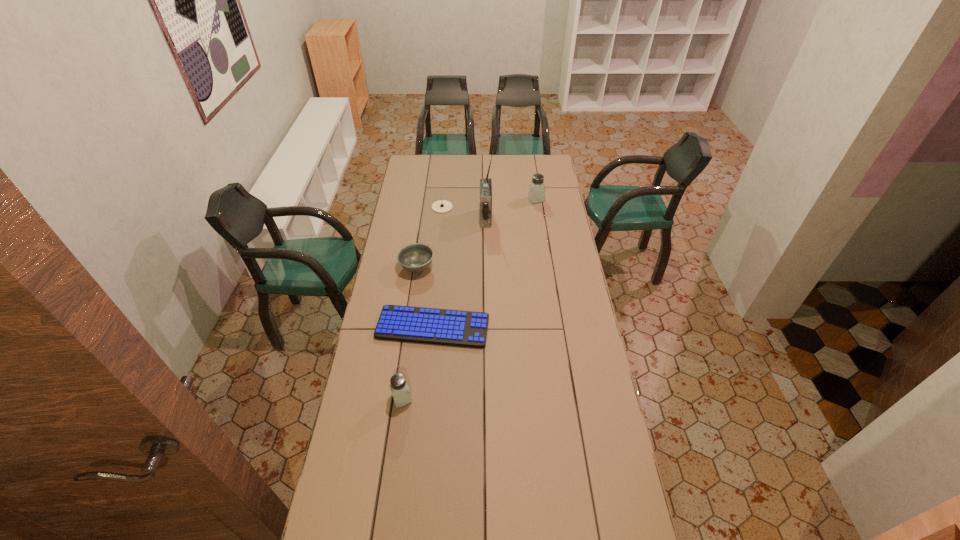
This screenshot has width=960, height=540. I want to click on the left saltshaker, so click(x=399, y=388).

At what (x,y) coordinates should I click in order to perform the action: click on the fourth shortest object. Please return your answer as a coordinate pair (x, y). Looking at the image, I should click on (399, 388).

The width and height of the screenshot is (960, 540). In order to click on the farther saltshaker in this screenshot , I will do `click(536, 192)`.

This screenshot has height=540, width=960. In order to click on the taller saltshaker in this screenshot , I will do `click(536, 192)`.

At what (x,y) coordinates should I click in order to perform the action: click on bowl. Please return your answer as a coordinate pair (x, y). The image size is (960, 540). Looking at the image, I should click on (416, 257).

Locate an element on the screen. the fourth farthest object is located at coordinates (416, 257).

The width and height of the screenshot is (960, 540). Identify the location of the second shortest object. (441, 206).

Locate an element on the screen. The height and width of the screenshot is (540, 960). radio receiver is located at coordinates (485, 183).

Locate an element on the screen. the fifth farthest object is located at coordinates (447, 327).

The height and width of the screenshot is (540, 960). Identify the location of the shortest object. (447, 327).